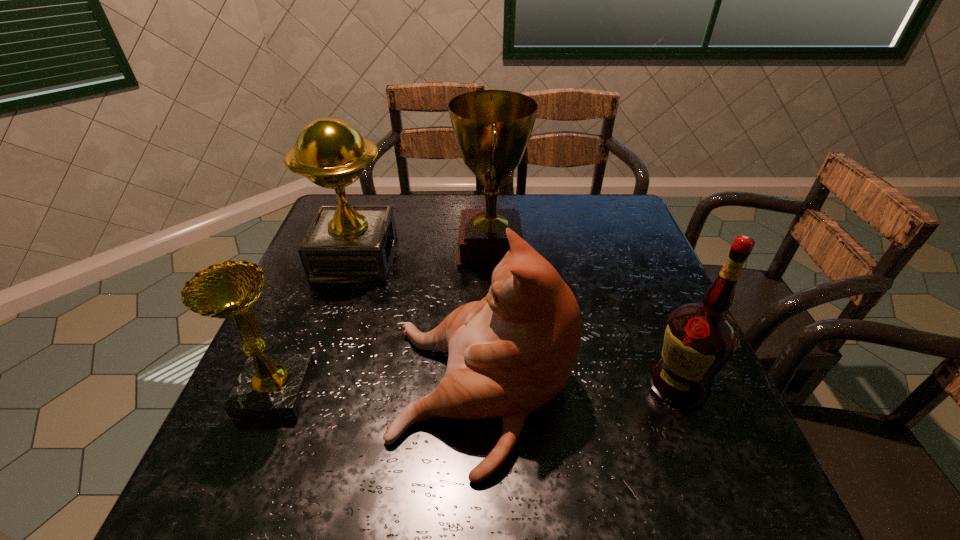
I want to click on the rightmost award, so point(492,128).

Locate an element on the screen. This screenshot has height=540, width=960. alcohol is located at coordinates (700, 338).

Locate an element on the screen. This screenshot has height=540, width=960. cat is located at coordinates (512, 352).

Where is `the nearest award`? Image resolution: width=960 pixels, height=540 pixels. the nearest award is located at coordinates (271, 386).

At what (x,y) coordinates should I click in order to perform the action: click on the shortest award. Please return your answer as a coordinate pair (x, y). The width and height of the screenshot is (960, 540). Looking at the image, I should click on (271, 386).

Locate an element on the screen. vacant space located on the plaque of the rightmost award is located at coordinates (437, 247).

The width and height of the screenshot is (960, 540). Identify the location of free space located 0.290m on the plaque of the rightmost award. (351, 247).

Image resolution: width=960 pixels, height=540 pixels. I want to click on free space located 0.070m on the plaque of the rightmost award, so click(430, 247).

This screenshot has width=960, height=540. What are the coordinates of `blank area located 0.100m on the label of the alcohol` in the screenshot? It's located at (599, 384).

Locate an element on the screen. This screenshot has height=540, width=960. blank space located 0.100m on the label of the alcohol is located at coordinates (599, 384).